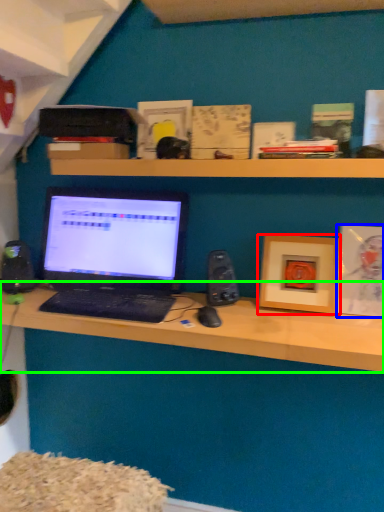
Question: Which is nearer to the picture frame (highlighted by a red box)? picture frame (highlighted by a blue box) or desk (highlighted by a green box).

Choices:
 (A) picture frame
 (B) desk

Answer: (A)